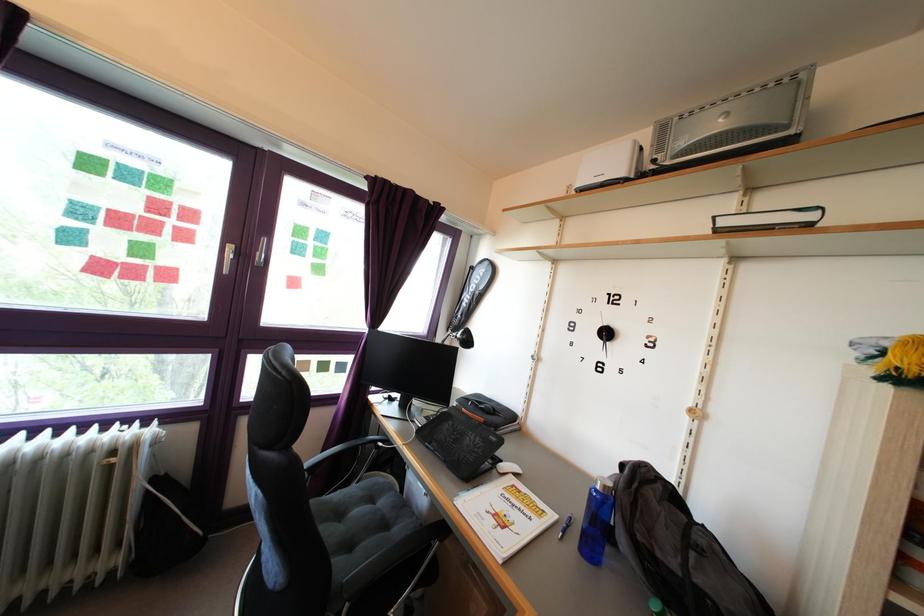
Where would you click the white computer mouse? Please return your answer as a coordinate pair (x, y).

(507, 468)